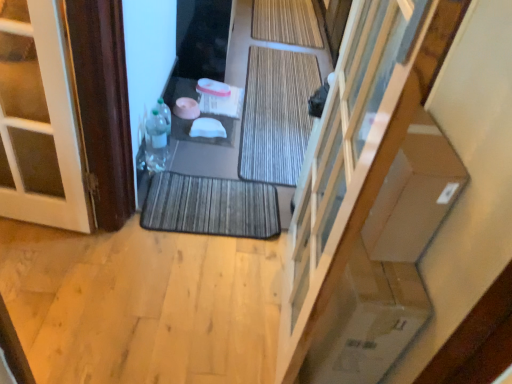
Question: From the image's perspective, is translucent plastic bottle at lower left, acting as the 2th bottle starting from the bottom, located beneath brown wood door at left?

Choices:
 (A) yes
 (B) no

Answer: (A)

Question: Can you confirm if translucent plastic bottle at lower left, marked as the first bottle in a top-to-bottom arrangement, is positioned to the left of brown wood door at left?

Choices:
 (A) yes
 (B) no

Answer: (B)

Question: Can you confirm if translucent plastic bottle at lower left, marked as the first bottle in a top-to-bottom arrangement, is bigger than brown wood door at left?

Choices:
 (A) yes
 (B) no

Answer: (B)

Question: From the image's perspective, would you say translucent plastic bottle at lower left, marked as the first bottle in a top-to-bottom arrangement, is positioned over brown wood door at left?

Choices:
 (A) yes
 (B) no

Answer: (B)

Question: Are translucent plastic bottle at lower left, marked as the first bottle in a top-to-bottom arrangement, and brown wood door at left beside each other?

Choices:
 (A) no
 (B) yes

Answer: (A)

Question: Can you confirm if translucent plastic bottle at lower left, marked as the first bottle in a top-to-bottom arrangement, is smaller than brown wood door at left?

Choices:
 (A) no
 (B) yes

Answer: (B)

Question: Is transparent glass door at center facing towards translucent plastic bottle at lower left, marked as the first bottle in a top-to-bottom arrangement?

Choices:
 (A) yes
 (B) no

Answer: (B)

Question: From a real-world perspective, is transparent glass door at center beneath translucent plastic bottle at lower left, acting as the 2th bottle starting from the bottom?

Choices:
 (A) yes
 (B) no

Answer: (B)

Question: Is transparent glass door at center bigger than translucent plastic bottle at lower left, acting as the 2th bottle starting from the bottom?

Choices:
 (A) no
 (B) yes

Answer: (B)

Question: Would you say translucent plastic bottle at lower left, marked as the first bottle in a top-to-bottom arrangement, is part of transparent glass door at center's contents?

Choices:
 (A) yes
 (B) no

Answer: (B)

Question: From a real-world perspective, does transparent glass door at center stand above translucent plastic bottle at lower left, acting as the 2th bottle starting from the bottom?

Choices:
 (A) no
 (B) yes

Answer: (B)

Question: From the image's perspective, is transparent glass door at center on translucent plastic bottle at lower left, marked as the first bottle in a top-to-bottom arrangement?

Choices:
 (A) no
 (B) yes

Answer: (A)

Question: Considering the relative positions of natural bamboo bath mat at center, placed as the third bath mat when sorted from front to back, and brown wood door at left in the image provided, is natural bamboo bath mat at center, placed as the third bath mat when sorted from front to back, to the right of brown wood door at left from the viewer's perspective?

Choices:
 (A) no
 (B) yes

Answer: (B)